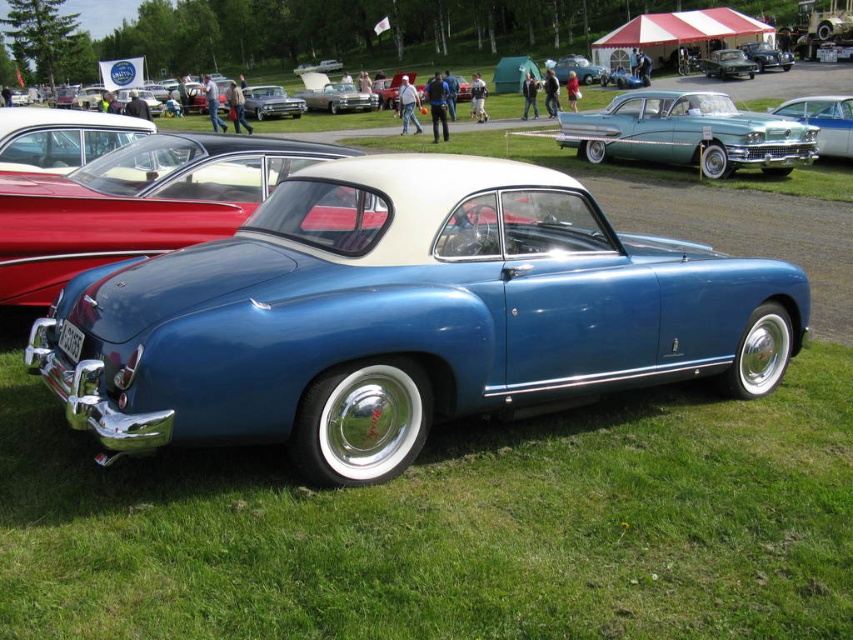
You are standing at the origin point of the coordinate system. You want to walk to the shiny silver car at center. In which direction should you move first?

Since the shiny silver car at center is located at coordinate point (265, 102), you should move northeast first to reach it.

You are a photographer at the car exhibition. You want to capture a photo that includes both the shiny black sedan at center and the metallic blue car at center. Which car should you position closer to the camera to ensure both are fully visible in the frame?

Since the shiny black sedan at center is not as tall as the metallic blue car at center, you should position the shiny black sedan at center closer to the camera. This will help balance their sizes in the photo so both appear fully visible.